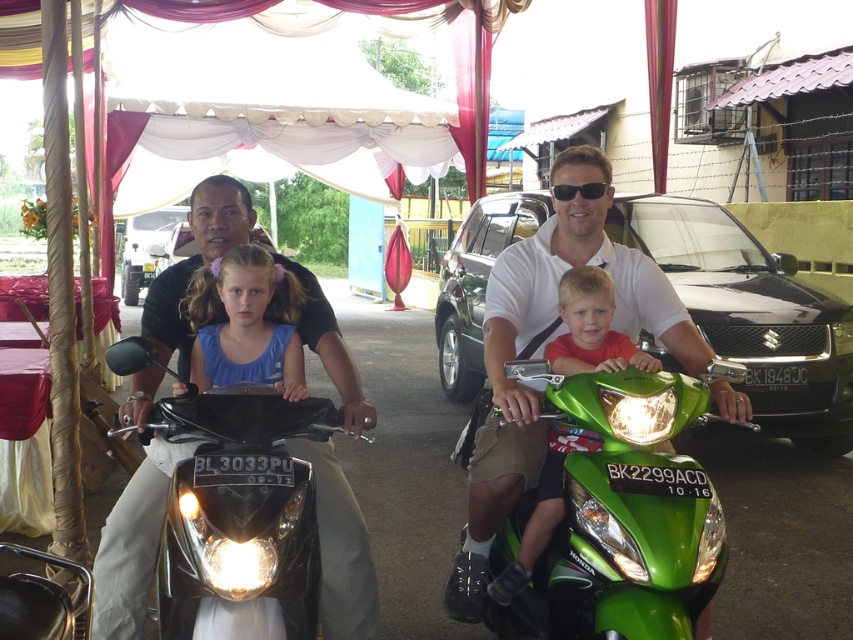
Which of these two, blue satin dress at center or matte green motorcycle at center, stands taller?

blue satin dress at center

Which of these two, blue satin dress at center or matte green motorcycle at center, stands shorter?

matte green motorcycle at center

What do you see at coordinates (247, 323) in the screenshot?
I see `blue satin dress at center` at bounding box center [247, 323].

Where is `blue satin dress at center`? blue satin dress at center is located at coordinates (247, 323).

Is black glossy motorcycle at center bigger than black plastic sunglasses at center?

Yes.

Does black glossy motorcycle at center have a greater height compared to black plastic sunglasses at center?

Indeed, black glossy motorcycle at center has a greater height compared to black plastic sunglasses at center.

Image resolution: width=853 pixels, height=640 pixels. In order to click on black glossy motorcycle at center in this screenshot , I will do `click(340, 548)`.

Does black metallic car at center have a smaller size compared to red matte shirt at center?

Incorrect, black metallic car at center is not smaller in size than red matte shirt at center.

Can you confirm if black metallic car at center is bigger than red matte shirt at center?

Correct, black metallic car at center is larger in size than red matte shirt at center.

Where is `black metallic car at center`? The image size is (853, 640). black metallic car at center is located at coordinates (751, 314).